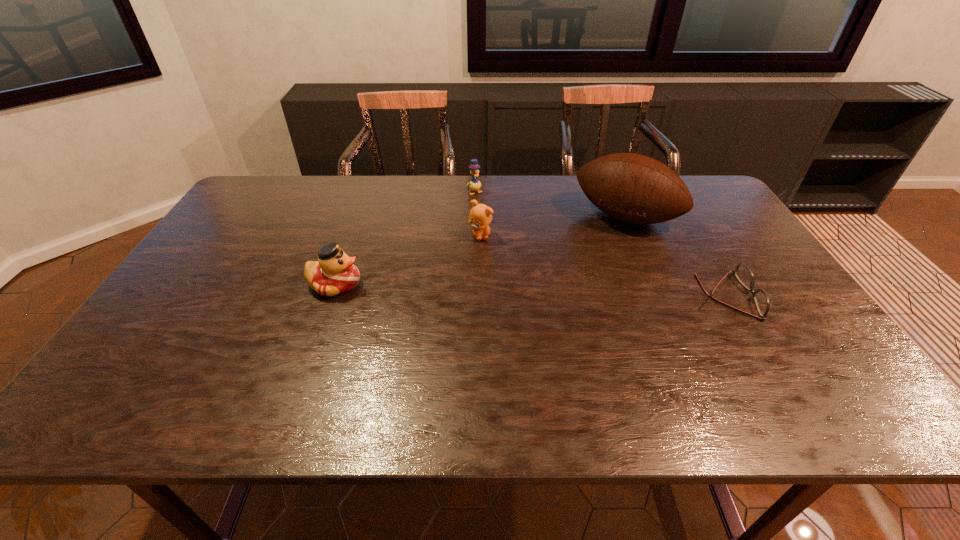
Identify the location of unoccupied position between the leftmost object and the duckling. Image resolution: width=960 pixels, height=540 pixels. (405, 238).

Where is `free space between the duck and the shortest object`? Image resolution: width=960 pixels, height=540 pixels. free space between the duck and the shortest object is located at coordinates [529, 290].

In order to click on free space between the football and the shortest object in this screenshot , I will do `click(675, 256)`.

The image size is (960, 540). I want to click on free space between the leftmost object and the tallest object, so click(x=480, y=251).

Where is `the third closest object relative to the teddy bear`? This screenshot has width=960, height=540. the third closest object relative to the teddy bear is located at coordinates (334, 273).

Where is `object that is the closest to the leftmost object`? object that is the closest to the leftmost object is located at coordinates (480, 216).

This screenshot has width=960, height=540. I want to click on free space that satisfies the following two spatial constraints: 1. on the front side of the shortest object; 2. on the front-facing side of the farthest object, so click(473, 296).

Locate an element on the screen. Image resolution: width=960 pixels, height=540 pixels. free location that satisfies the following two spatial constraints: 1. on the front side of the tallest object; 2. on the right side of the farthest object is located at coordinates (474, 217).

The height and width of the screenshot is (540, 960). I want to click on vacant point that satisfies the following two spatial constraints: 1. on the back side of the teddy bear; 2. on the right side of the tallest object, so tap(481, 217).